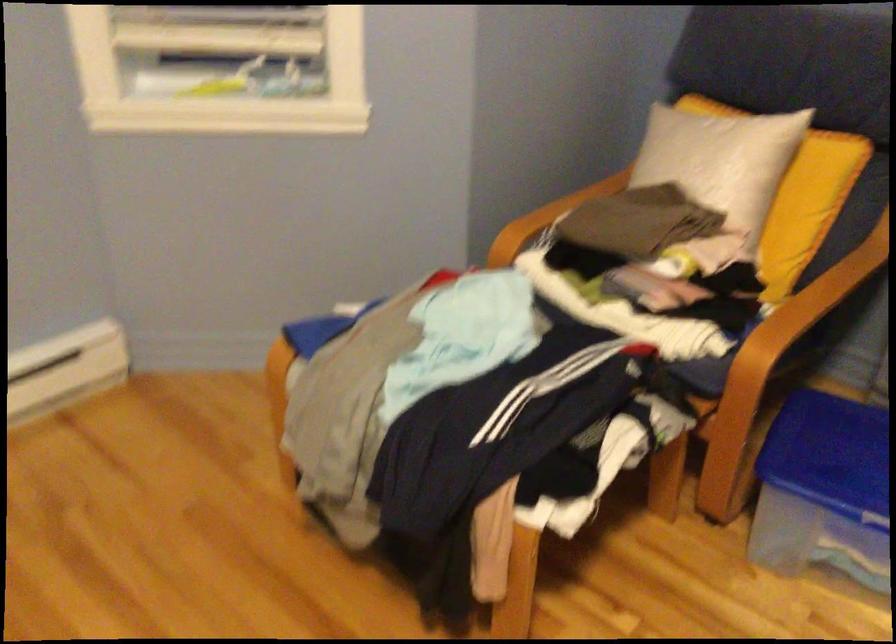
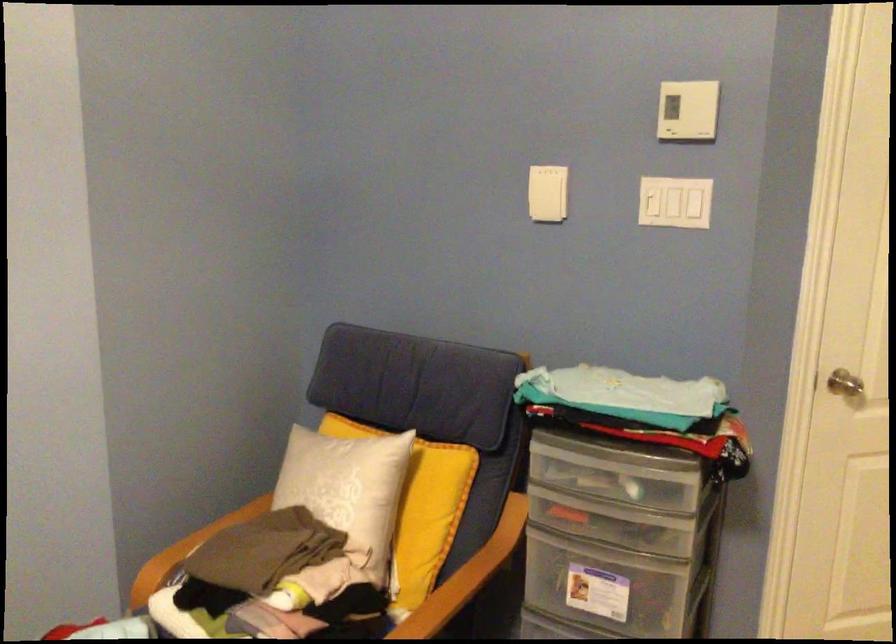
In the second image, find the point that corresponds to point 531,220 in the first image.

(178, 551)